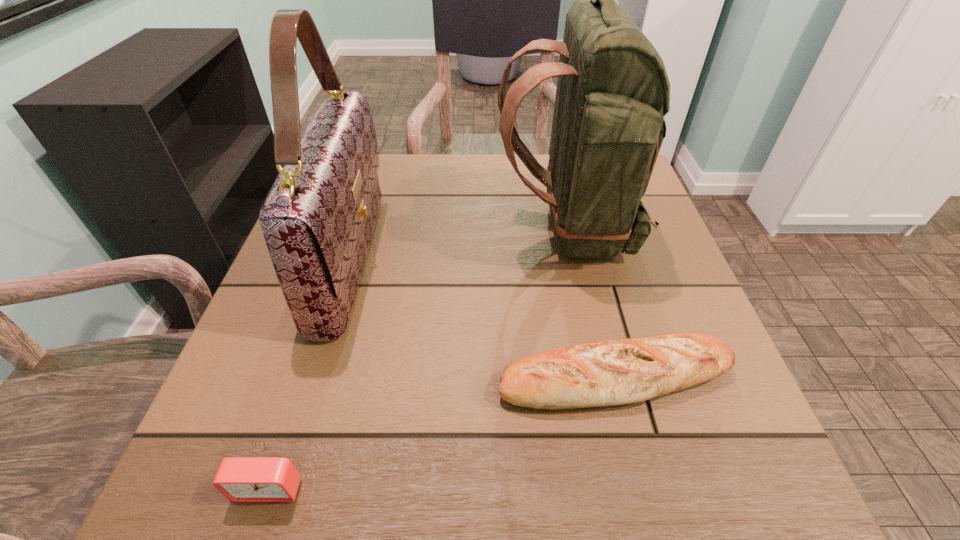
Image resolution: width=960 pixels, height=540 pixels. I want to click on vacant space in between the nearest object and the backpack, so click(x=418, y=358).

You are a GUI agent. You are given a task and a screenshot of the screen. Output one action in this format:
    pyautogui.click(x=<x>, y=<y>)
    Task: Click on the blank region between the backpack and the alarm clock
    
    Given the screenshot: What is the action you would take?
    pyautogui.click(x=418, y=358)

Where is `free spot between the nearest object and the backpack`? The width and height of the screenshot is (960, 540). free spot between the nearest object and the backpack is located at coordinates (418, 358).

At what (x,y) coordinates should I click in order to perform the action: click on free space between the handbag and the backpack. Please return your answer as a coordinate pair (x, y). The height and width of the screenshot is (540, 960). Looking at the image, I should click on (459, 244).

Identify the location of object that is the third closest one to the baguet. This screenshot has width=960, height=540. (240, 479).

Where is `object that is the third closest one to the handbag`? Image resolution: width=960 pixels, height=540 pixels. object that is the third closest one to the handbag is located at coordinates (613, 91).

Locate an element on the screen. This screenshot has width=960, height=540. free location that satisfies the following two spatial constraints: 1. on the back of the backpack; 2. on the back side of the baguet is located at coordinates (600, 378).

Locate an element on the screen. The width and height of the screenshot is (960, 540). vacant space that satisfies the following two spatial constraints: 1. on the front of the handbag with the clasp; 2. on the back side of the baguet is located at coordinates (314, 378).

Identify the location of blank space that satisfies the following two spatial constraints: 1. on the back side of the baguet; 2. on the back of the backpack. (577, 228).

Identify the location of vacant space that satisfies the following two spatial constraints: 1. on the front of the handbag with the clasp; 2. on the front-facing side of the alarm clock. The image size is (960, 540). (280, 488).